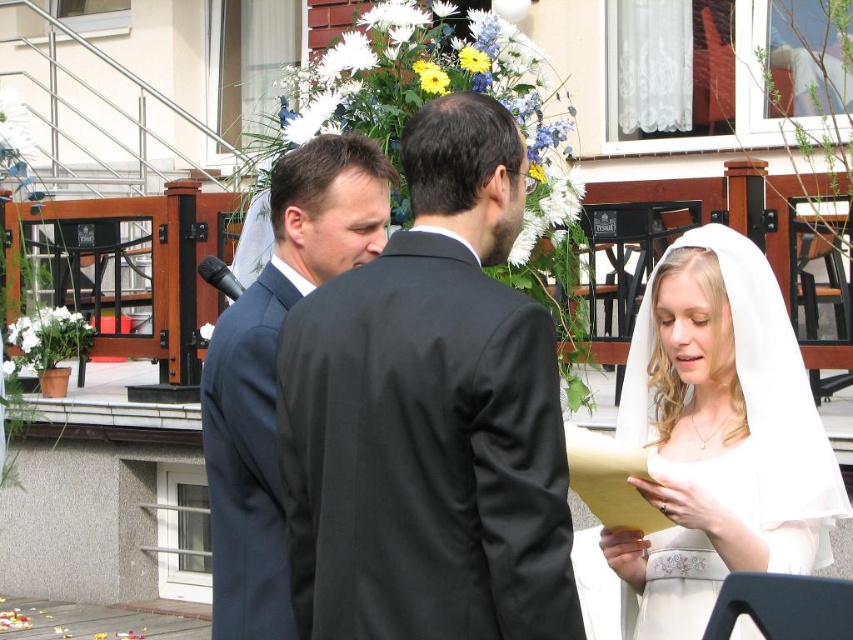
Between white sheer veil at lower right and dark blue suit at center, which one has more height?

dark blue suit at center

Who is shorter, white sheer veil at lower right or dark blue suit at center?

Standing shorter between the two is white sheer veil at lower right.

Is point (824, 486) closer to camera compared to point (273, 634)?

Yes.

Locate an element on the screen. Image resolution: width=853 pixels, height=640 pixels. white sheer veil at lower right is located at coordinates (711, 445).

Can you confirm if white satin veil at upper right is wider than matte black suit at center?

Incorrect, white satin veil at upper right's width does not surpass matte black suit at center's.

Does white satin veil at upper right have a lesser height compared to matte black suit at center?

Correct, white satin veil at upper right is not as tall as matte black suit at center.

You are a GUI agent. You are given a task and a screenshot of the screen. Output one action in this format:
    pyautogui.click(x=<x>, y=<y>)
    Task: Click on the white satin veil at upper right
    Image resolution: width=853 pixels, height=640 pixels.
    Given the screenshot: What is the action you would take?
    pyautogui.click(x=424, y=410)

Is point (805, 474) farther from camera compared to point (763, 484)?

No, it is not.

Looking at this image, between white satin veil at upper right and white sheer veil at lower right, which one is positioned higher?

white sheer veil at lower right is above.

Is point (701, 305) closer to viewer compared to point (755, 488)?

No, (701, 305) is further to viewer.

Locate an element on the screen. The width and height of the screenshot is (853, 640). white satin veil at upper right is located at coordinates click(424, 410).